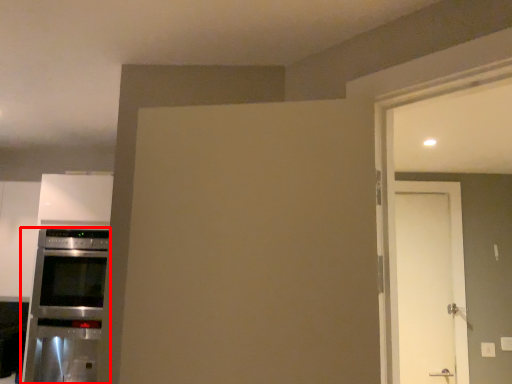
Question: Where is home appliance (annotated by the red box) located in relation to door in the image?

Choices:
 (A) left
 (B) right

Answer: (A)